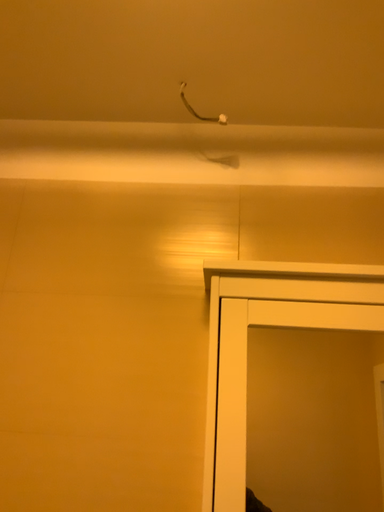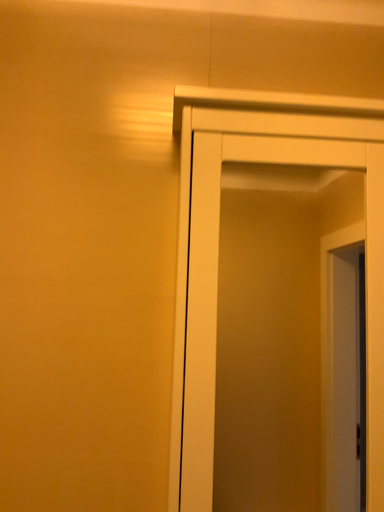
Question: How did the camera likely rotate when shooting the video?

Choices:
 (A) rotated left
 (B) rotated right

Answer: (B)